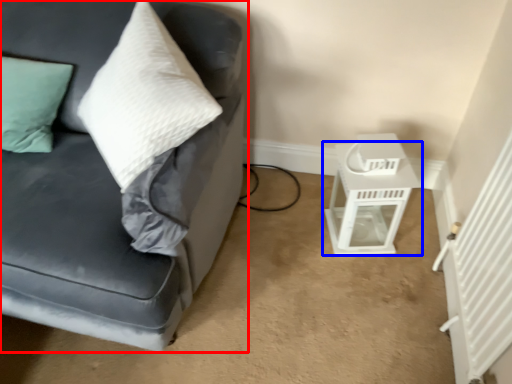
Question: Which object appears farthest to the camera in this image, studio couch (highlighted by a red box) or table (highlighted by a blue box)?

Choices:
 (A) studio couch
 (B) table

Answer: (B)